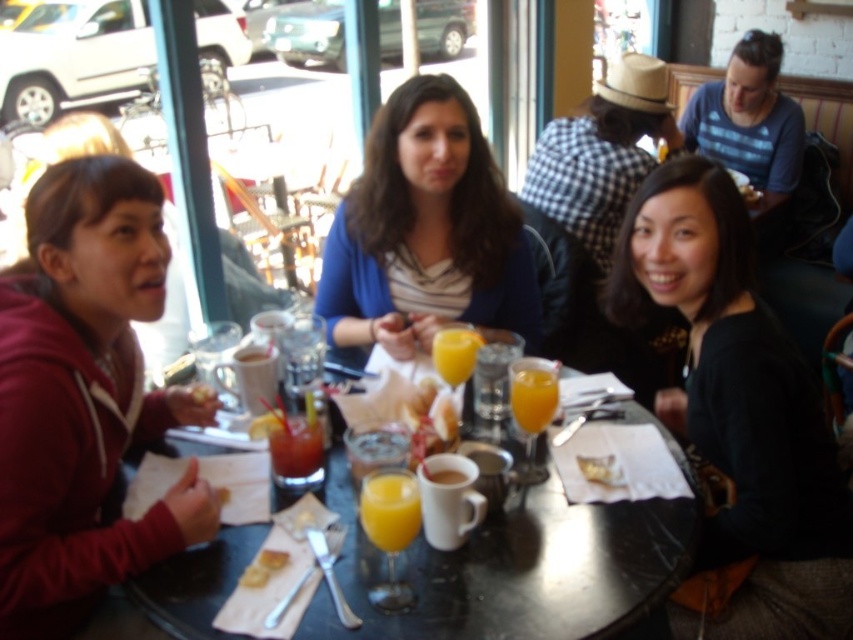
You are standing in the center of the room and want to place a new dessert plate on the black glass table at center. What are the coordinates where you should aim to place it?

The black glass table at center is located at coordinates point (515,568), so place the dessert plate there.

Consider the image. You are a customer at the cafe and want to place your phone on the table. You have a choice between placing it on the maroon hoodie at left or the golden brown bread at center. Which surface would you choose to ensure the phone doesn

The golden brown bread at center is smaller than the maroon hoodie at left, so placing the phone on the maroon hoodie at left would provide a more stable and larger surface area to prevent it from falling off.